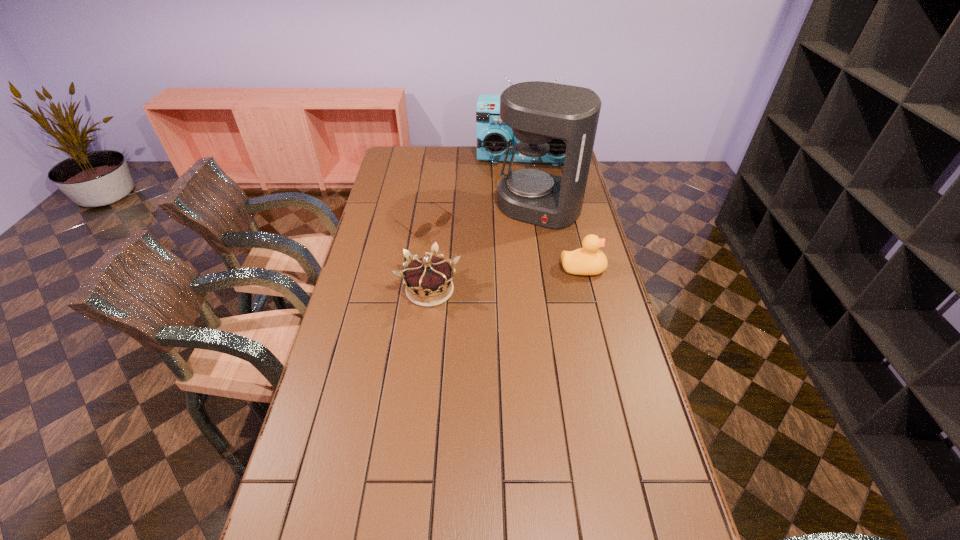
Where is `vacant space located on the front-facing side of the tallest object`? This screenshot has height=540, width=960. vacant space located on the front-facing side of the tallest object is located at coordinates (516, 246).

I want to click on vacant space located 0.180m on the front-facing side of the tallest object, so click(x=510, y=258).

Where is `vacant space located 0.280m on the front-facing side of the tallest object`? This screenshot has width=960, height=540. vacant space located 0.280m on the front-facing side of the tallest object is located at coordinates (499, 275).

This screenshot has height=540, width=960. Identify the location of vacant space located on the face of the shortest object. (459, 248).

Where is `vacant space located on the face of the shortest object`? vacant space located on the face of the shortest object is located at coordinates (463, 251).

Identify the location of vacant space located on the face of the shortest object. Image resolution: width=960 pixels, height=540 pixels. (506, 280).

This screenshot has height=540, width=960. Find the location of `object present at the far edge`. object present at the far edge is located at coordinates (494, 137).

This screenshot has height=540, width=960. Find the location of `object that is at the left edge`. object that is at the left edge is located at coordinates (444, 218).

At what (x,y) coordinates should I click in order to perform the action: click on duck present at the right edge. Please return your answer as a coordinate pair (x, y). This screenshot has width=960, height=540. Looking at the image, I should click on (589, 260).

Image resolution: width=960 pixels, height=540 pixels. I want to click on radio receiver present at the right edge, so click(494, 137).